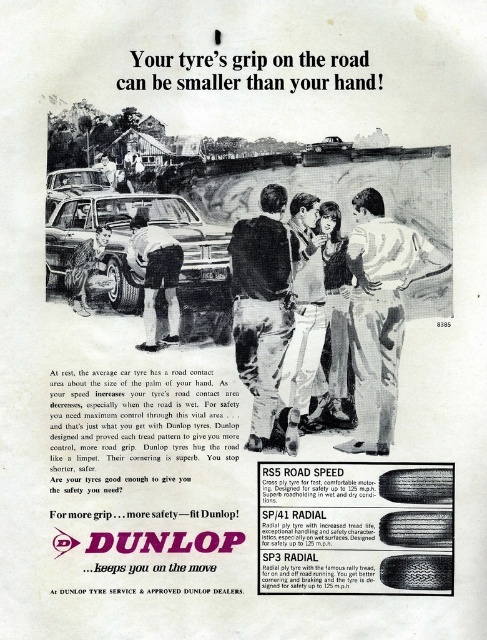
You are a tailor measuring two pairs of jeans in the vintage ad. The dark blue jeans at center and the denim jeans at center. Which pair is farther from the edge of the ad?

The dark blue jeans at center is farther from the edge of the ad than the denim jeans at center because the distance between them is 7.91 centimeters, implying the dark blue jeans is positioned further away from the edge compared to the denim jeans.

You are a photographer standing in front of the vintage Dunlop tire advertisement. You notice two points marked on the ad. The first point is at coordinate point (250, 380) and the second is at point (82, 266). Which point is closer to you?

Point (82, 266) is closer to you because the description states that point (250, 380) is further to the camera than point (82, 266).

You are observing the vintage Dunlop tire advertisement. Notice the denim jeans at center and the light gray fabric shirt at lower left. Which clothing item appears taller in the image?

The denim jeans at center is taller than the light gray fabric shirt at lower left.